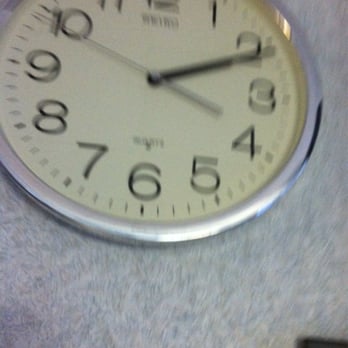
This screenshot has width=348, height=348. Identify the location of blurry light reflection off of the clock. (287, 30), (286, 20), (289, 38), (280, 26), (278, 13), (281, 20).